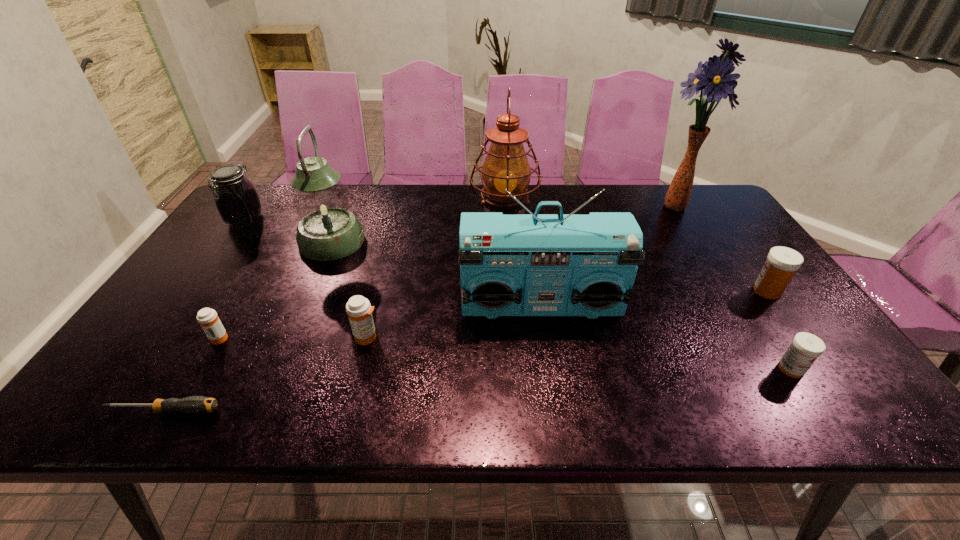
Identify the location of free point at the near right corner. This screenshot has height=540, width=960. (836, 418).

The width and height of the screenshot is (960, 540). In order to click on free space between the oil lamp and the second nearest object in this screenshot , I will do `click(648, 290)`.

You are a GUI agent. You are given a task and a screenshot of the screen. Output one action in this format:
    pyautogui.click(x=<x>, y=<y>)
    Task: Click on the vacant region between the right white medicine and the nearest medicine
    This screenshot has width=960, height=540.
    Given the screenshot: What is the action you would take?
    pyautogui.click(x=780, y=330)

Identify the location of free space between the screwdriver and the tallest object. (420, 308).

This screenshot has width=960, height=540. I want to click on free spot between the sixth object from right to left and the nearest object, so click(265, 374).

Where is `object that is the eighth nearest to the jar`? object that is the eighth nearest to the jar is located at coordinates (782, 262).

Where is `object that is the eighth closest to the sixth shortest object`? Image resolution: width=960 pixels, height=540 pixels. object that is the eighth closest to the sixth shortest object is located at coordinates (782, 262).

Identify the location of medicine that is the fourth closest to the oil lamp. (207, 318).

Where is `the closest medicine to the bigger orange medicine`? This screenshot has width=960, height=540. the closest medicine to the bigger orange medicine is located at coordinates (207, 318).

Locate an element on the screen. free space in the image that satisfies the following two spatial constraints: 1. on the back side of the smaller orange medicine; 2. on the left side of the bigger white medicine is located at coordinates (246, 291).